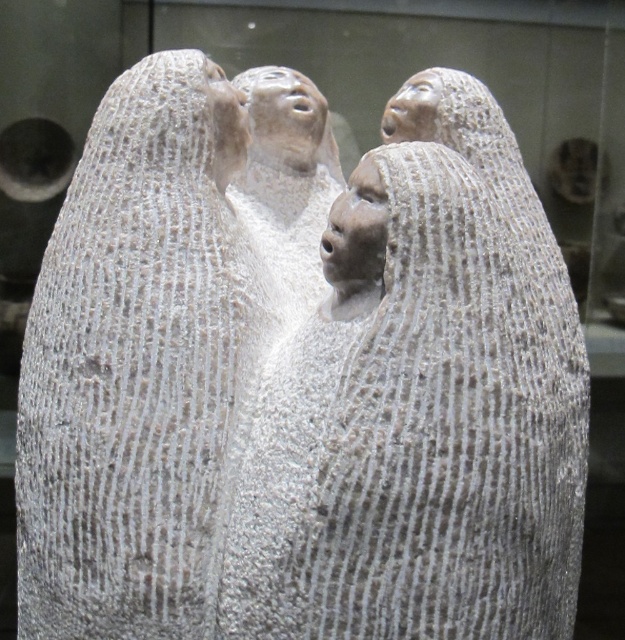
You are an art conservator examining the stone sculpture. You notice the gray textured stone statue at upper center and the gray textured stone head at upper center. Which object is located higher in the image?

The gray textured stone head at upper center is higher because the gray textured stone statue at upper center is positioned under it.

You are standing in front of a stone sculpture with four figures. You want to locate the gray textured stone statue at upper center. What are its coordinates?

The gray textured stone statue at upper center is located at coordinates point (140, 365).

You are an artist standing at the edge of a room where the image is displayed. You need to sketch the gray textured stone figures at center. To ensure accuracy, where should you position yourself relative to the display to capture their central location?

The gray textured stone figures at center are located at point 2D coordinates at (420, 406), so you should position yourself directly in front of that central point to accurately sketch them.